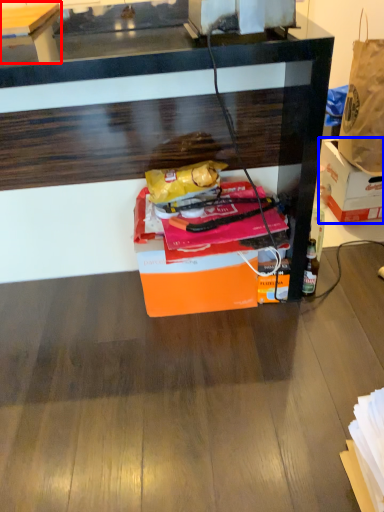
Question: Which object appears closest to the camera in this image, table (highlighted by a red box) or box (highlighted by a blue box)?

Choices:
 (A) table
 (B) box

Answer: (A)